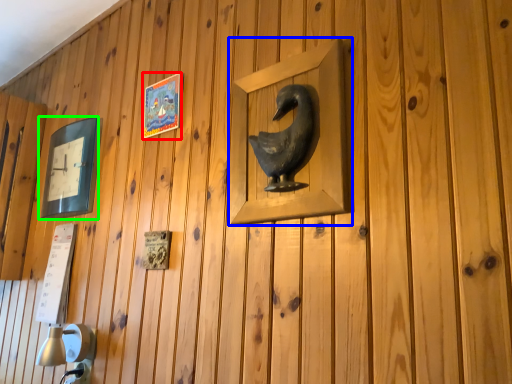
Question: Which object is positioned farthest from picture frame (highlighted by a red box)? Select from picture frame (highlighted by a blue box) and picture frame (highlighted by a green box).

Choices:
 (A) picture frame
 (B) picture frame

Answer: (A)